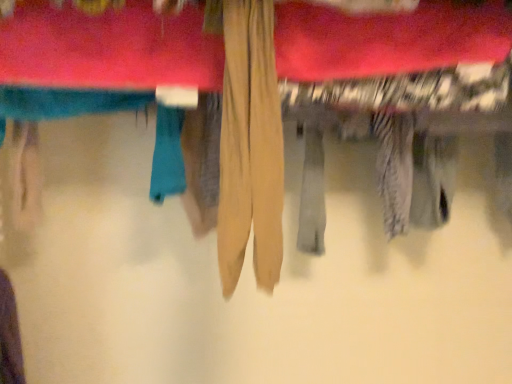
Question: From a real-world perspective, is beige fabric towel at center located higher than tan fabric pants at center?

Choices:
 (A) no
 (B) yes

Answer: (B)

Question: Is beige fabric towel at center oriented away from tan fabric pants at center?

Choices:
 (A) no
 (B) yes

Answer: (A)

Question: Is beige fabric towel at center taller than tan fabric pants at center?

Choices:
 (A) yes
 (B) no

Answer: (B)

Question: Considering the relative positions of beige fabric towel at center and tan fabric pants at center in the image provided, is beige fabric towel at center to the right of tan fabric pants at center from the viewer's perspective?

Choices:
 (A) no
 (B) yes

Answer: (B)

Question: From the image's perspective, is beige fabric towel at center located beneath tan fabric pants at center?

Choices:
 (A) no
 (B) yes

Answer: (A)

Question: Can you confirm if beige fabric towel at center is wider than tan fabric pants at center?

Choices:
 (A) no
 (B) yes

Answer: (A)

Question: From the image's perspective, is tan fabric pants at center on top of beige fabric towel at center?

Choices:
 (A) no
 (B) yes

Answer: (A)

Question: Is tan fabric pants at center looking in the opposite direction of beige fabric towel at center?

Choices:
 (A) no
 (B) yes

Answer: (A)

Question: From a real-world perspective, is tan fabric pants at center on top of beige fabric towel at center?

Choices:
 (A) no
 (B) yes

Answer: (A)

Question: Considering the relative positions of tan fabric pants at center and beige fabric towel at center in the image provided, is tan fabric pants at center to the left of beige fabric towel at center from the viewer's perspective?

Choices:
 (A) yes
 (B) no

Answer: (A)

Question: Considering the relative sizes of tan fabric pants at center and beige fabric towel at center in the image provided, is tan fabric pants at center taller than beige fabric towel at center?

Choices:
 (A) yes
 (B) no

Answer: (A)

Question: Does tan fabric pants at center appear on the right side of beige fabric towel at center?

Choices:
 (A) yes
 (B) no

Answer: (B)

Question: From a real-world perspective, is beige fabric towel at center above or below tan fabric pants at center?

Choices:
 (A) above
 (B) below

Answer: (A)